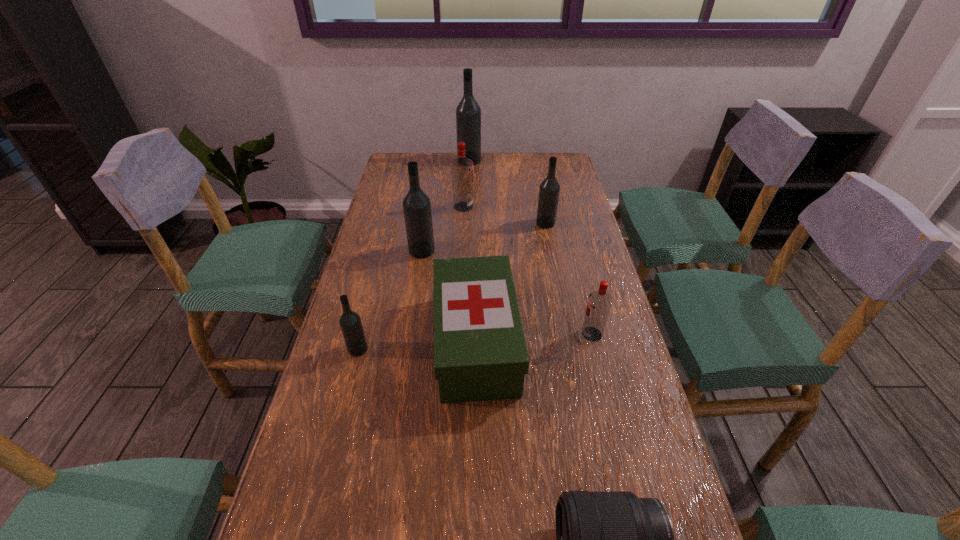
At what (x,y) coordinates should I click in order to perform the action: click on free space located on the right of the leftmost vodka. Please return your answer as a coordinate pair (x, y). This screenshot has height=540, width=960. Looking at the image, I should click on (392, 349).

Find the location of a particular element. The width and height of the screenshot is (960, 540). vacant area situated 0.230m on the back of the first-aid kit is located at coordinates (477, 244).

This screenshot has width=960, height=540. I want to click on object located at the far edge, so click(468, 113).

Image resolution: width=960 pixels, height=540 pixels. Find the location of `free space at the far edge`. free space at the far edge is located at coordinates (520, 164).

Where is `vacant space at the left edge`? The image size is (960, 540). vacant space at the left edge is located at coordinates (334, 426).

Where is `free space at the right edge of the desktop`? This screenshot has height=540, width=960. free space at the right edge of the desktop is located at coordinates (584, 240).

This screenshot has height=540, width=960. Identify the location of vacant space at the far left corner. (393, 159).

You are a GUI agent. You are given a task and a screenshot of the screen. Output one action in this format:
    pyautogui.click(x=<x>, y=<y>)
    Task: Click on the unoccupied area between the third smallest black vodka and the tallest vodka
    The height and width of the screenshot is (540, 960).
    Given the screenshot: What is the action you would take?
    pyautogui.click(x=445, y=206)

You are a GUI agent. You are given a task and a screenshot of the screen. Output one action in this format:
    pyautogui.click(x=<x>, y=<y>)
    Task: Click on the empty location between the leftmost black vodka and the green first-aid kit
    
    Given the screenshot: What is the action you would take?
    pyautogui.click(x=417, y=346)

I want to click on vacant area between the leftmost object and the left red vodka, so click(411, 278).